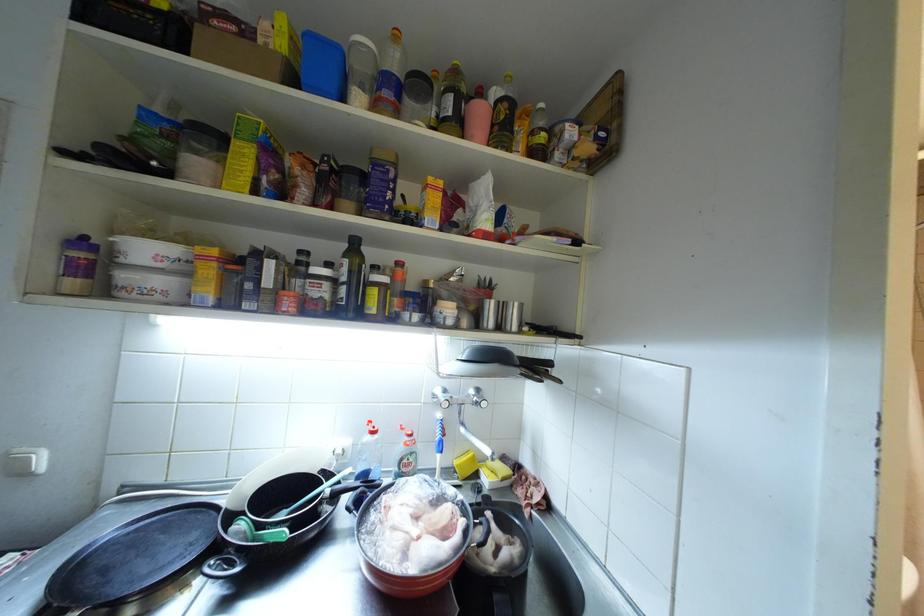
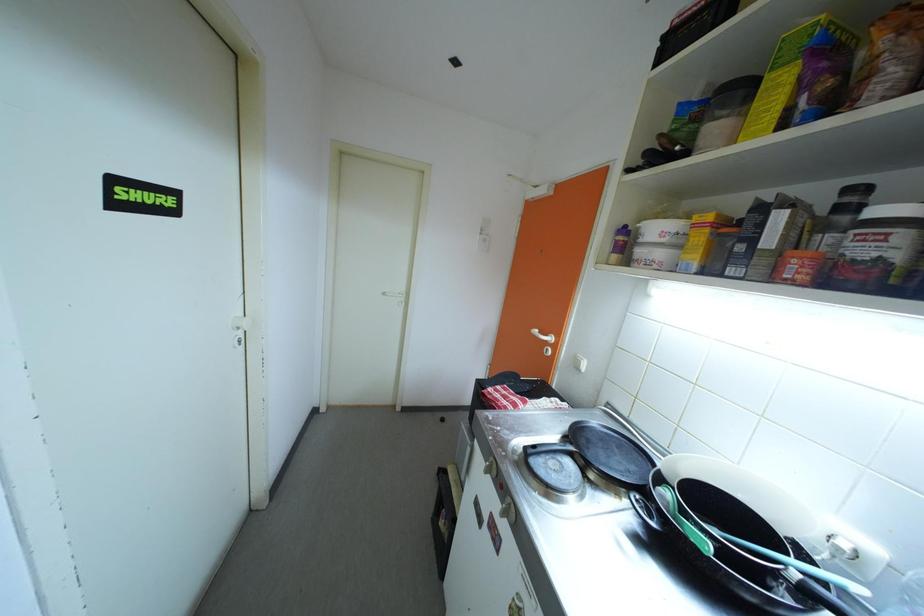
Question: The camera is either moving clockwise (left) or counter-clockwise (right) around the object. The first image is from the beginning of the video and the second image is from the end. Is the camera moving left or right when shooting the video?

Choices:
 (A) Left
 (B) Right

Answer: (B)